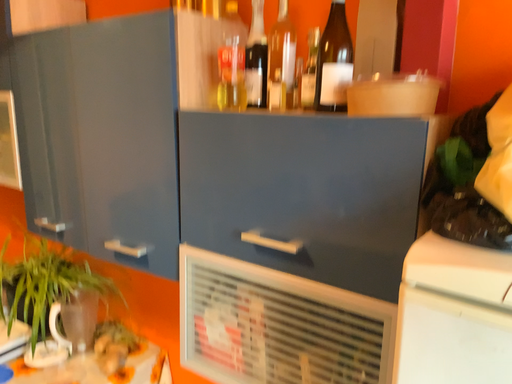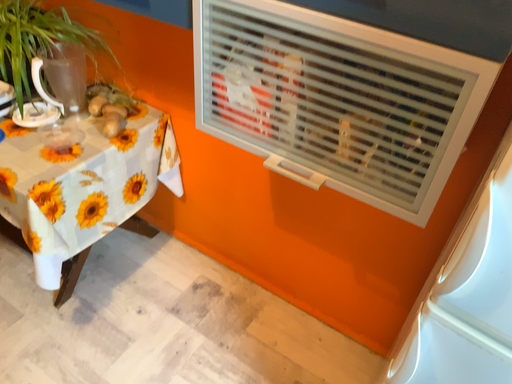
Question: Which way did the camera rotate in the video?

Choices:
 (A) rotated downward
 (B) rotated upward

Answer: (A)